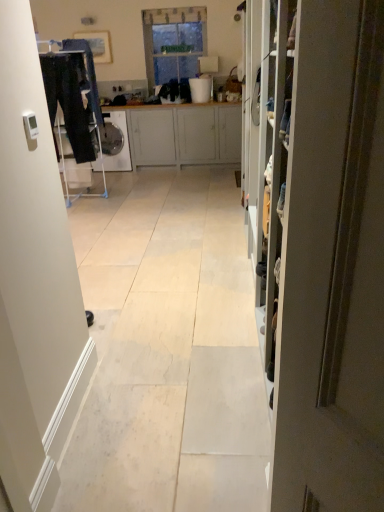
Question: From a real-world perspective, is dark blue jeans at left physically located above or below clear glass window at center?

Choices:
 (A) below
 (B) above

Answer: (A)

Question: Relative to clear glass window at center, is dark blue jeans at left in front or behind?

Choices:
 (A) front
 (B) behind

Answer: (A)

Question: Considering the real-world distances, which object is closest to the white glossy dishwasher at center?

Choices:
 (A) light gray wood cabinet at center
 (B) white plastic bucket at upper center
 (C) dark blue jeans at left
 (D) matte gray door at right
 (E) clear glass window at center

Answer: (A)

Question: Which is farther from the dark blue jeans at left?

Choices:
 (A) clear glass window at center
 (B) matte gray door at right
 (C) light gray wood cabinet at center
 (D) white glossy dishwasher at center
 (E) white plastic bucket at upper center

Answer: (B)